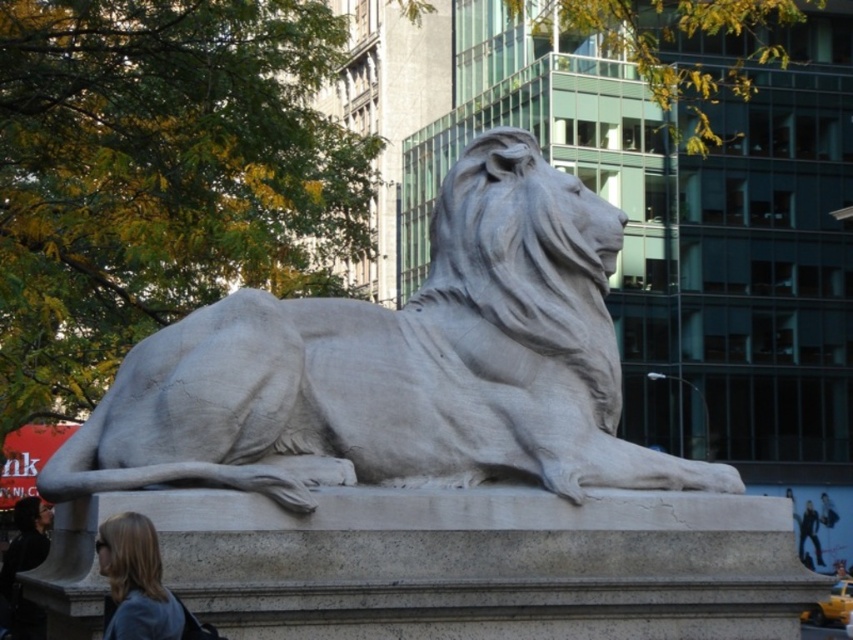
Question: Among these points, which one is farthest from the camera?

Choices:
 (A) (112, 616)
 (B) (322, 464)

Answer: (B)

Question: Can you confirm if white stone lion at center is smaller than blonde hair at lower left?

Choices:
 (A) no
 (B) yes

Answer: (A)

Question: From the image, what is the correct spatial relationship of white stone lion at center in relation to blonde hair at lower left?

Choices:
 (A) above
 (B) below

Answer: (A)

Question: Which point is farther to the camera?

Choices:
 (A) white stone lion at center
 (B) blonde hair at lower left

Answer: (A)

Question: Considering the relative positions of white stone lion at center and blonde hair at lower left in the image provided, where is white stone lion at center located with respect to blonde hair at lower left?

Choices:
 (A) below
 (B) above

Answer: (B)

Question: Which point is farther to the camera?

Choices:
 (A) (511, 388)
 (B) (109, 525)

Answer: (A)